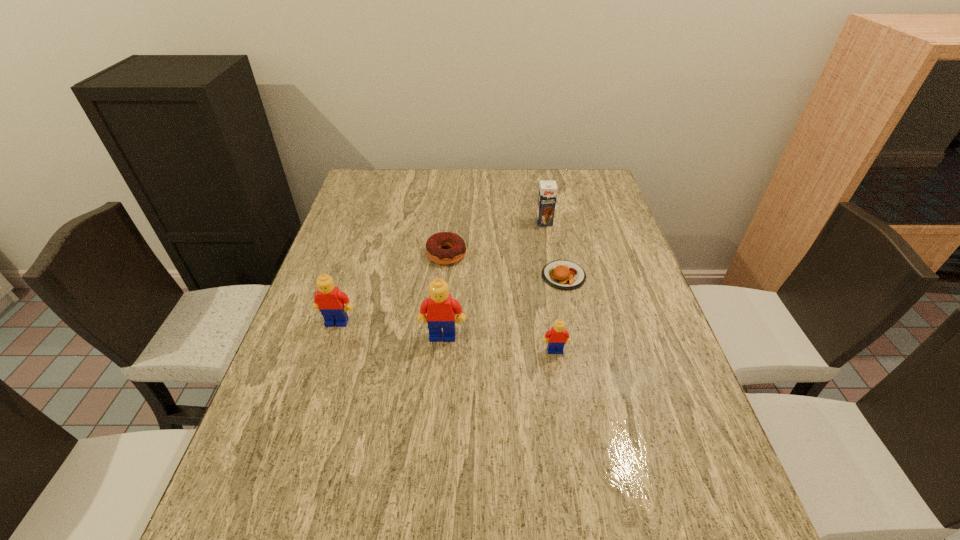
In the image, there is a desktop. Where is `vacant region at the right edge`? The width and height of the screenshot is (960, 540). vacant region at the right edge is located at coordinates (569, 225).

Image resolution: width=960 pixels, height=540 pixels. In order to click on free spot at the far right corner of the desktop in this screenshot , I will do `click(592, 194)`.

Where is `vacant space at the near right corner`? vacant space at the near right corner is located at coordinates (640, 453).

At what (x,y) coordinates should I click in order to perform the action: click on free space that is in between the doughnut and the farthest object. Please return your answer as a coordinate pair (x, y). Looking at the image, I should click on (495, 238).

The image size is (960, 540). I want to click on free space that is in between the rightmost Lego and the chocolate milk, so pyautogui.click(x=550, y=286).

Identify the location of empty space between the second farthest Lego and the chocolate milk. (493, 279).

The height and width of the screenshot is (540, 960). In order to click on free spot between the doughnut and the shortest Lego in this screenshot , I will do `click(501, 302)`.

You are a GUI agent. You are given a task and a screenshot of the screen. Output one action in this format:
    pyautogui.click(x=<x>, y=<y>)
    Task: Click on the vacant space in between the second nearest object and the leftmost Lego
    This screenshot has height=540, width=960.
    Given the screenshot: What is the action you would take?
    pyautogui.click(x=390, y=329)

Identify the location of empty space that is in between the second nearest Lego and the chocolate milk. (493, 279).

You are a GUI agent. You are given a task and a screenshot of the screen. Output one action in this format:
    pyautogui.click(x=<x>, y=<y>)
    Task: Click on the free spot between the shortest object and the shortest Lego
    The height and width of the screenshot is (540, 960).
    Given the screenshot: What is the action you would take?
    pyautogui.click(x=560, y=313)